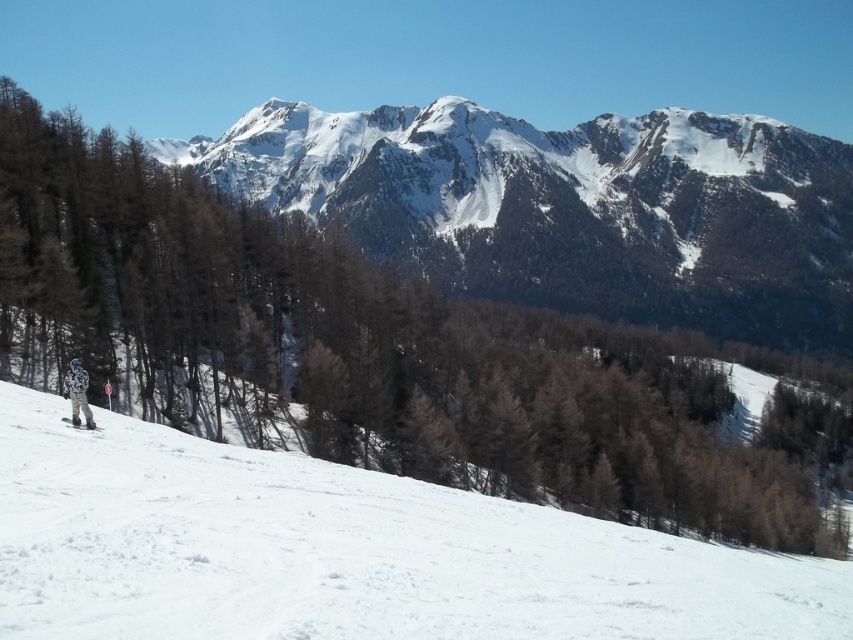
You are planning a hiking route starting from the white snow at lower left and want to reach the snowy granite mountain at upper center. Based on the scene, which direction should you head to ascend towards the mountain?

To ascend towards the snowy granite mountain at upper center from the white snow at lower left, you should head upwards since the white snow at lower left is positioned under the snowy granite mountain at upper center, indicating the mountain is above the snow area.

You are standing at the point marked by the red and white signpost near the person in the winter landscape. Looking towards the direction of the slope, where would the point at coordinate point [346,552] be located relative to you?

The point at coordinate point [346,552] is on white snow at lower left, so it would be located to your lower left direction from the signpost.